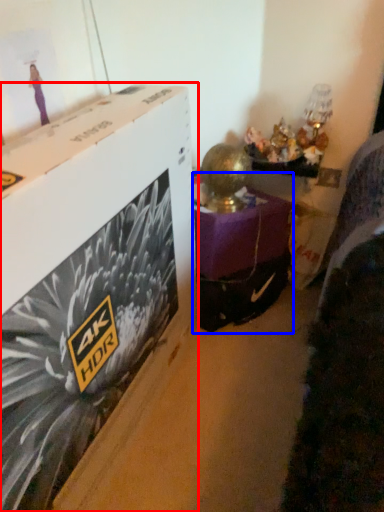
Question: Which object appears closest to the camera in this image, box (highlighted by a red box) or furniture (highlighted by a blue box)?

Choices:
 (A) box
 (B) furniture

Answer: (A)